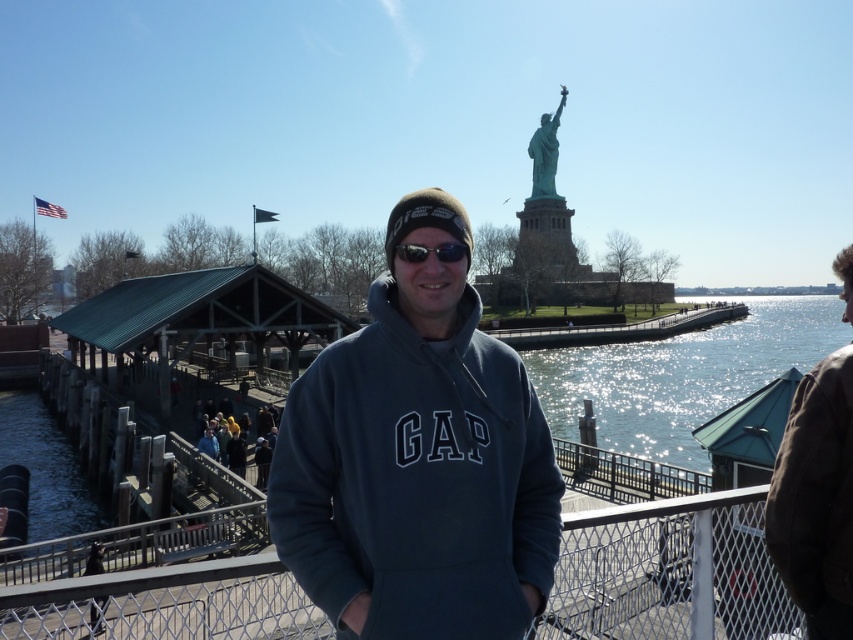
Question: Considering the real-world distances, which object is farthest from the green patina statue at upper center?

Choices:
 (A) dark gray fleece at center
 (B) shiny reflective water at lower center
 (C) sunglasses at center
 (D) blue fabric jacket at lower left

Answer: (C)

Question: Is metallic chain-link fence at center to the right of shiny reflective water at lower center from the viewer's perspective?

Choices:
 (A) yes
 (B) no

Answer: (B)

Question: Considering the real-world distances, which object is farthest from the blue fabric jacket at lower left?

Choices:
 (A) brown leather jacket at right
 (B) green patina statue at upper center

Answer: (B)

Question: Can you confirm if metallic chain-link fence at center is positioned to the left of shiny reflective water at lower center?

Choices:
 (A) yes
 (B) no

Answer: (A)

Question: Is brown leather jacket at right to the right of green patina statue at upper center from the viewer's perspective?

Choices:
 (A) no
 (B) yes

Answer: (A)

Question: Based on their relative distances, which object is nearer to the sunglasses at center?

Choices:
 (A) brown leather jacket at right
 (B) shiny reflective water at lower center
 (C) green patina statue at upper center

Answer: (A)